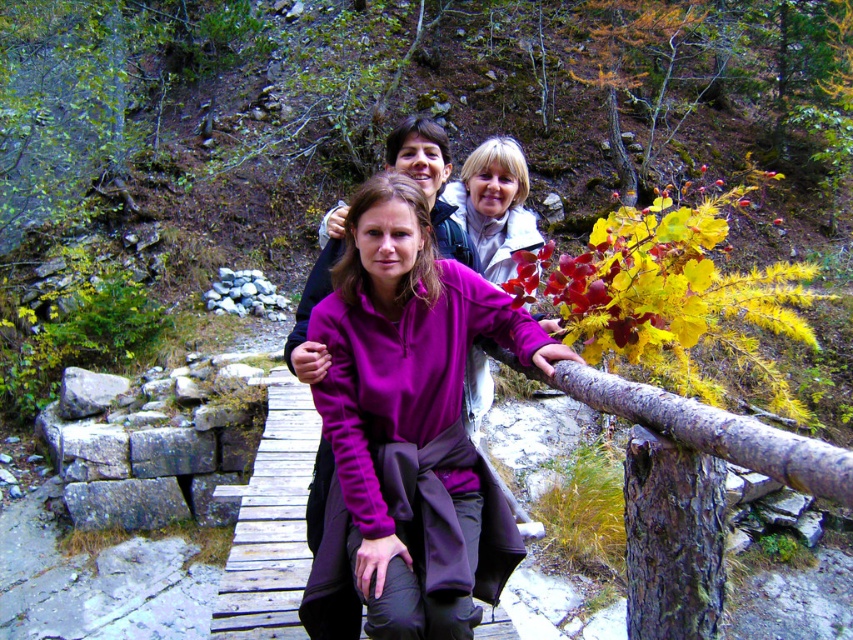
Can you confirm if purple fleece jacket at center is positioned below wooden bridge at center?

No, purple fleece jacket at center is not below wooden bridge at center.

Does point (524, 314) come farther from viewer compared to point (283, 579)?

No, (524, 314) is in front of (283, 579).

The image size is (853, 640). What do you see at coordinates (407, 429) in the screenshot?
I see `purple fleece jacket at center` at bounding box center [407, 429].

Find the location of a particular element. The image size is (853, 640). purple fleece jacket at center is located at coordinates (407, 429).